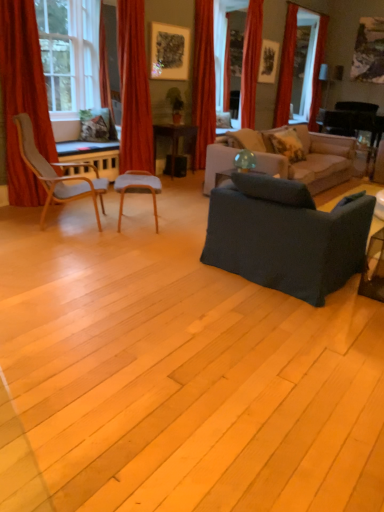
Question: From the image's perspective, relative to matte gray chair at center, which is the first chair from right to left, is fluffy beige pillow at upper right above or below?

Choices:
 (A) below
 (B) above

Answer: (B)

Question: Is point (273, 137) closer or farther from the camera than point (145, 179)?

Choices:
 (A) closer
 (B) farther

Answer: (B)

Question: Which is farther from the dark gray fabric couch at center, positioned as the 2th studio couch in back-to-front order?

Choices:
 (A) black glossy table at center
 (B) red velvet curtain at upper right, marked as the second curtain in a back-to-front arrangement
 (C) velvet red curtain at upper left, which ranks as the 2th curtain in front-to-back order
 (D) red velvet curtain at left, arranged as the 1th curtain when viewed from the front
 (E) fluffy beige pillow at upper right

Answer: (B)

Question: Considering the real-world distances, which object is farthest from the red velvet curtain at upper center, arranged as the fourth curtain when viewed from the back?

Choices:
 (A) dark gray fabric couch at center, the 1th studio couch from the front
 (B) red velvet curtain at upper center, which appears as the 3th curtain when viewed from the right
 (C) velvet red curtain at upper left, which is the fifth curtain from back to front
 (D) black glossy table at center
 (E) matte gray chair at center, which is the first chair from right to left

Answer: (A)